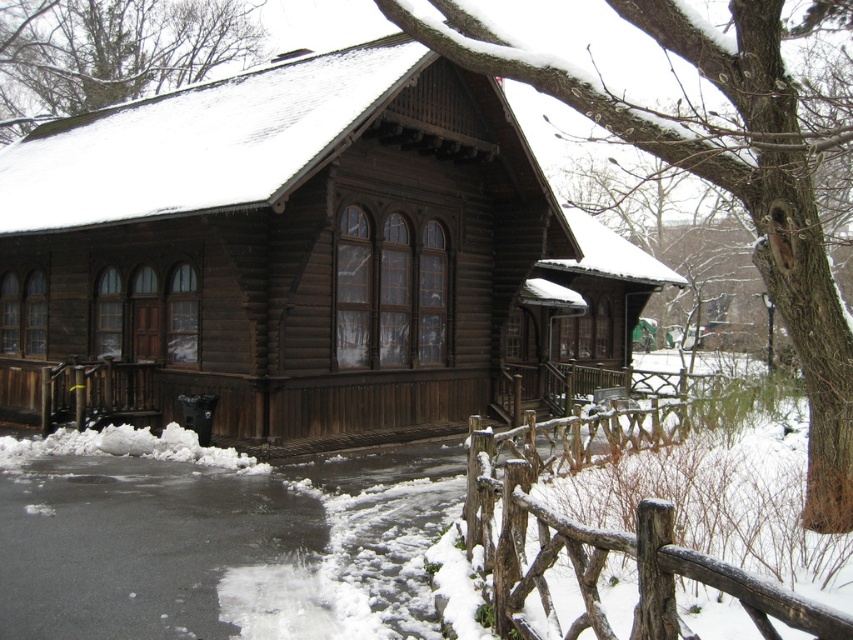
Is rustic wooden fence at lower right above snow-covered wood at upper center?

No.

Is point (692, 552) farther from camera compared to point (65, 33)?

No, (692, 552) is in front of (65, 33).

In order to click on rustic wooden fence at lower right in this screenshot , I will do click(602, 529).

Is smooth brown bark at center shorter than snow-covered wood at upper center?

Correct, smooth brown bark at center is not as tall as snow-covered wood at upper center.

Who is taller, smooth brown bark at center or snow-covered wood at upper center?

snow-covered wood at upper center is taller.

Is point (764, 273) positioned before point (99, 77)?

Yes, point (764, 273) is closer to viewer.

At what (x,y) coordinates should I click in order to perform the action: click on smooth brown bark at center. Please return your answer as a coordinate pair (x, y). The height and width of the screenshot is (640, 853). Looking at the image, I should click on (717, 184).

Who is taller, smooth brown bark at center or rustic wooden fence at lower right?

With more height is smooth brown bark at center.

Who is lower down, smooth brown bark at center or rustic wooden fence at lower right?

Positioned lower is rustic wooden fence at lower right.

Does point (744, 92) come closer to viewer compared to point (608, 541)?

No, it is behind (608, 541).

In order to click on smooth brown bark at center in this screenshot , I will do `click(717, 184)`.